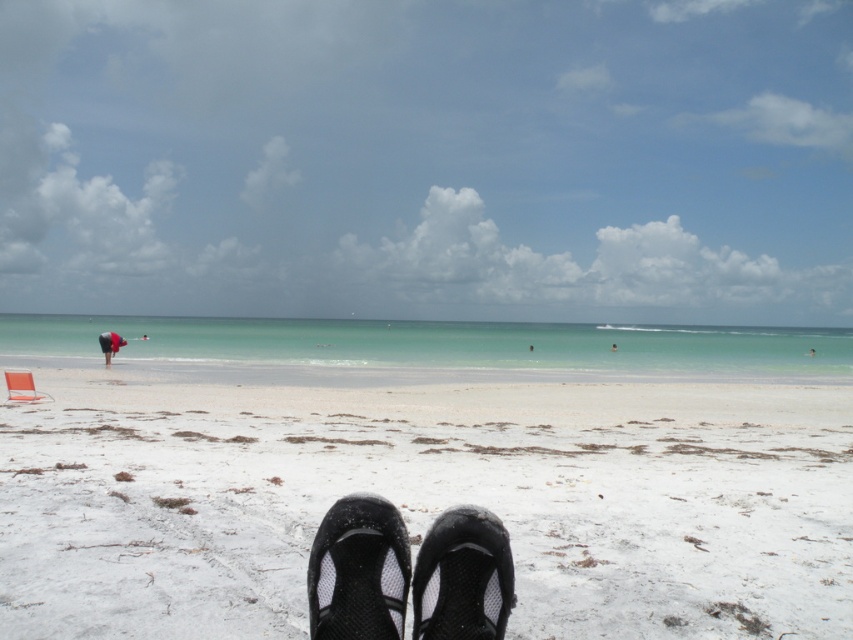
Question: Is black mesh shoe at center thinner than dark blue fabric person at center?

Choices:
 (A) no
 (B) yes

Answer: (B)

Question: Among these objects, which one is nearest to the camera?

Choices:
 (A) black mesh sandal at center
 (B) white sandy beach at center
 (C) black mesh shoe at center

Answer: (A)

Question: Is black mesh sandal at center positioned at the back of black mesh shoe at center?

Choices:
 (A) no
 (B) yes

Answer: (A)

Question: Which of these objects is positioned closest to the black fabric person at left?

Choices:
 (A) black mesh shoe at center
 (B) dark blue fabric person at center
 (C) black mesh sandal at center

Answer: (C)

Question: Which point is farther from the camera taking this photo?

Choices:
 (A) (612, 348)
 (B) (171, 490)

Answer: (A)

Question: Is black mesh shoe at center below black fabric person at left?

Choices:
 (A) yes
 (B) no

Answer: (B)